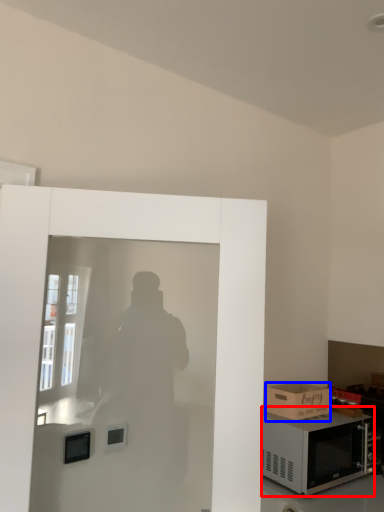
Question: Which of the following is the closest to the observer, microwave oven (highlighted by a red box) or box (highlighted by a blue box)?

Choices:
 (A) microwave oven
 (B) box

Answer: (A)